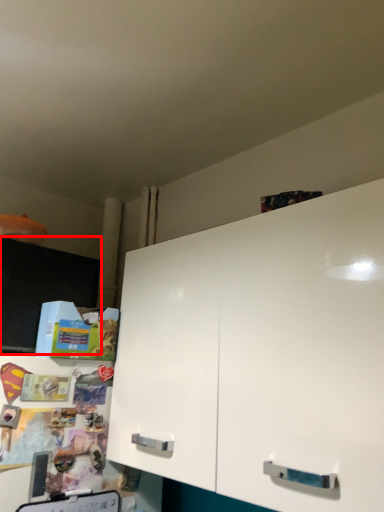
Question: From the image, what is the correct spatial relationship of cabinetry (annotated by the red box) in relation to cabinetry?

Choices:
 (A) left
 (B) right

Answer: (A)